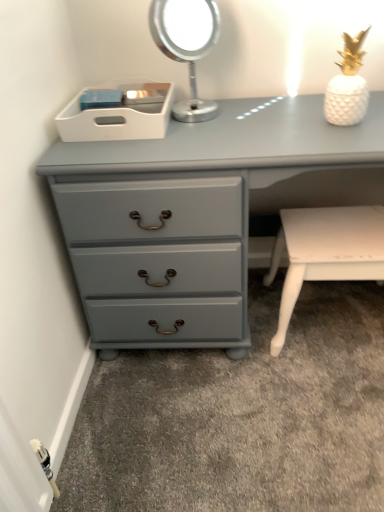
Question: Looking at their shapes, would you say matte gray chest of drawers at lower left is wider or thinner than metallic silver mirror at upper center?

Choices:
 (A) thin
 (B) wide

Answer: (B)

Question: In the image, is matte gray chest of drawers at lower left positioned in front of or behind metallic silver mirror at upper center?

Choices:
 (A) front
 (B) behind

Answer: (A)

Question: Estimate the real-world distances between objects in this image. Which object is farther from the metallic silver mirror at upper center?

Choices:
 (A) matte gray chest of drawers at lower left
 (B) white glossy table at lower right
 (C) white plastic tray at upper center

Answer: (B)

Question: Estimate the real-world distances between objects in this image. Which object is farther from the white glossy table at lower right?

Choices:
 (A) metallic silver mirror at upper center
 (B) matte gray chest of drawers at lower left
 (C) white plastic tray at upper center

Answer: (C)